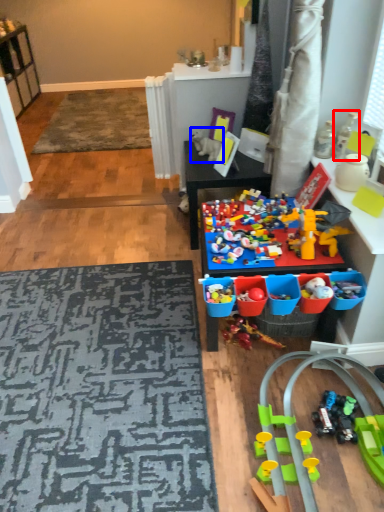
Question: Among these objects, which one is nearest to the camera, toy (highlighted by a red box) or toy (highlighted by a blue box)?

Choices:
 (A) toy
 (B) toy

Answer: (A)